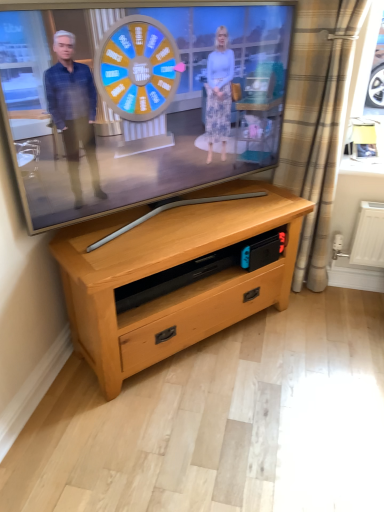
Question: From a real-world perspective, relative to light wood chest of drawers at center, is matte wooden tv at center vertically above or below?

Choices:
 (A) above
 (B) below

Answer: (A)

Question: Considering the positions of matte wooden tv at center and light wood chest of drawers at center in the image, is matte wooden tv at center wider or thinner than light wood chest of drawers at center?

Choices:
 (A) thin
 (B) wide

Answer: (A)

Question: Estimate the real-world distances between objects in this image. Which object is closer to the matte wooden tv at center?

Choices:
 (A) beige plaid curtain at right
 (B) light wood chest of drawers at center

Answer: (B)

Question: Estimate the real-world distances between objects in this image. Which object is closer to the light wood chest of drawers at center?

Choices:
 (A) matte wooden tv at center
 (B) beige plaid curtain at right

Answer: (A)